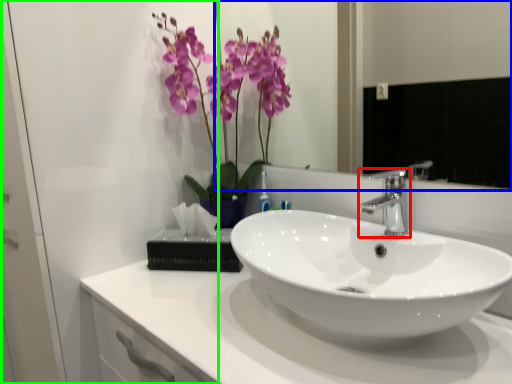
Question: Which is nearer to the tap (highlighted by a red box)? mirror (highlighted by a blue box) or glass door (highlighted by a green box).

Choices:
 (A) mirror
 (B) glass door

Answer: (B)